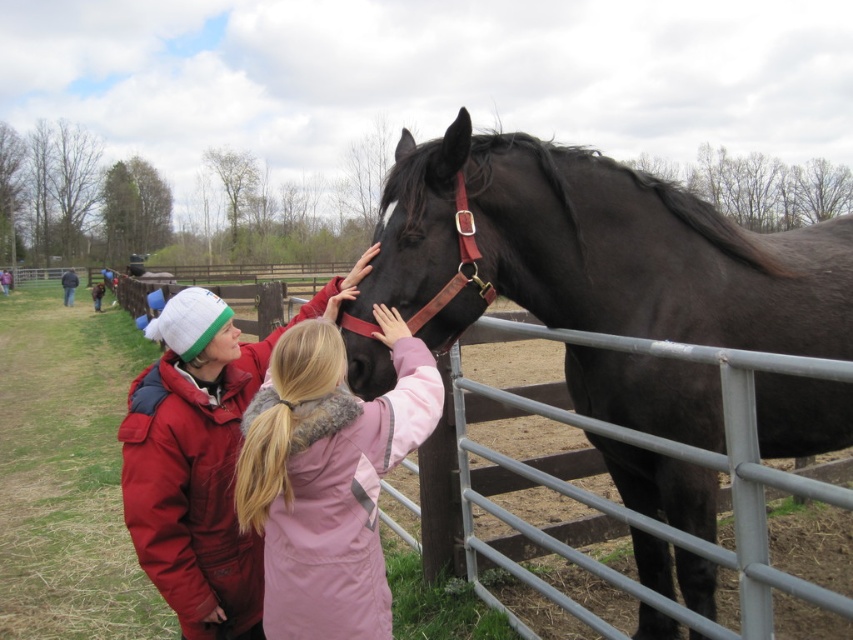
Does point (389, 323) come behind point (64, 275)?

No.

Is pink fuzzy coat at center above dark blue jacket at left?

Incorrect, pink fuzzy coat at center is not positioned above dark blue jacket at left.

You are a GUI agent. You are given a task and a screenshot of the screen. Output one action in this format:
    pyautogui.click(x=<x>, y=<y>)
    Task: Click on the pink fuzzy coat at center
    This screenshot has height=640, width=853.
    Given the screenshot: What is the action you would take?
    pyautogui.click(x=328, y=477)

The height and width of the screenshot is (640, 853). What do you see at coordinates (596, 250) in the screenshot? I see `black leather horse at center` at bounding box center [596, 250].

Locate an element on the screen. The image size is (853, 640). black leather horse at center is located at coordinates (596, 250).

Is point (672, 208) farther from camera compared to point (62, 282)?

No, (672, 208) is in front of (62, 282).

What are the coordinates of `black leather horse at center` in the screenshot? It's located at (596, 250).

Does black leather horse at center appear under pink fuzzy coat at center?

Actually, black leather horse at center is above pink fuzzy coat at center.

Is point (509, 202) farther from viewer compared to point (294, 552)?

Yes.

Find the location of a particular element. The width and height of the screenshot is (853, 640). black leather horse at center is located at coordinates (596, 250).